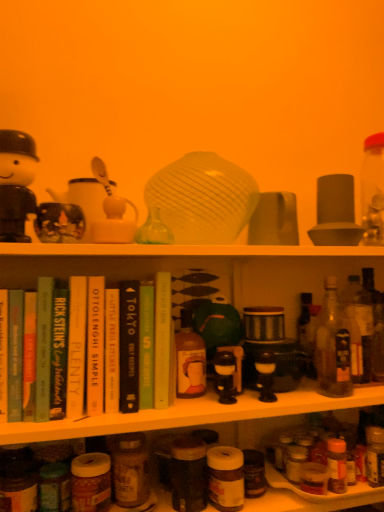
At what (x,y) coordinates should I click in order to perform the action: click on vacant area to the right of black hardcover book at center, which is counted as the third book, starting from the left. Please return your answer as a coordinate pair (x, y). This screenshot has height=512, width=384. Looking at the image, I should click on (206, 403).